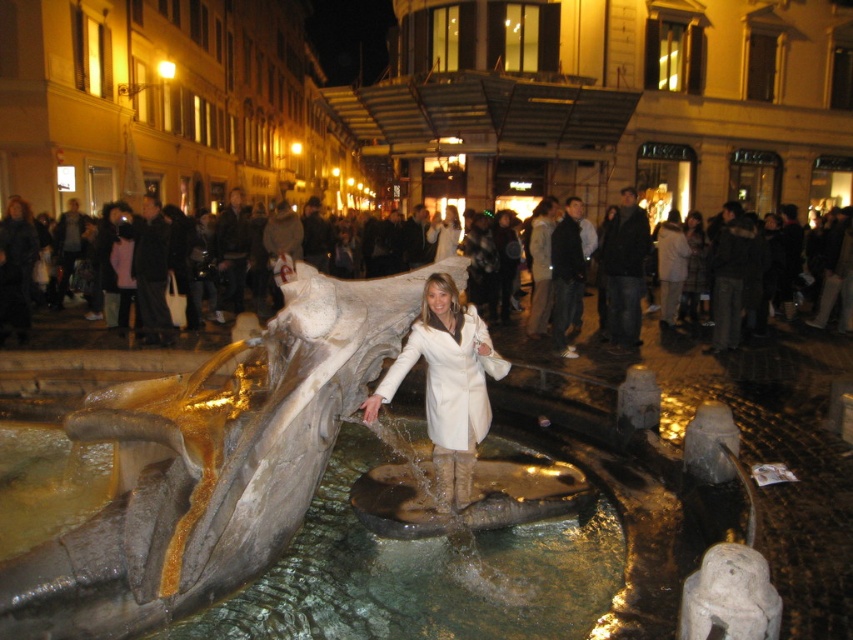
Question: Does translucent stone water at center appear under white leather coat at center?

Choices:
 (A) no
 (B) yes

Answer: (B)

Question: Is translucent stone water at center thinner than white leather coat at center?

Choices:
 (A) no
 (B) yes

Answer: (A)

Question: Which object appears farthest from the camera in this image?

Choices:
 (A) white textured crowd at center
 (B) white leather coat at center

Answer: (A)

Question: Does white leather coat at center appear on the left side of white textured crowd at center?

Choices:
 (A) yes
 (B) no

Answer: (B)

Question: Which of these objects is positioned closest to the white textured crowd at center?

Choices:
 (A) white leather coat at center
 (B) translucent stone water at center

Answer: (A)

Question: Which point appears closest to the camera in this image?

Choices:
 (A) (451, 330)
 (B) (44, 323)

Answer: (A)